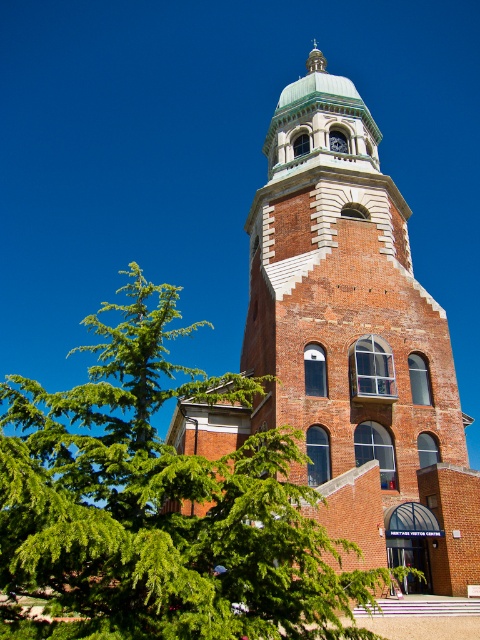
Question: Is green leafy tree at lower left positioned behind brick tower at center?

Choices:
 (A) no
 (B) yes

Answer: (A)

Question: Does green leafy tree at lower left have a larger size compared to brick tower at center?

Choices:
 (A) yes
 (B) no

Answer: (B)

Question: Which object is farther from the camera taking this photo?

Choices:
 (A) brick tower at center
 (B) green leafy tree at lower left

Answer: (A)

Question: Is green leafy tree at lower left thinner than brick tower at center?

Choices:
 (A) yes
 (B) no

Answer: (B)

Question: Among these objects, which one is farthest from the camera?

Choices:
 (A) brick tower at center
 (B) green leafy tree at lower left

Answer: (A)